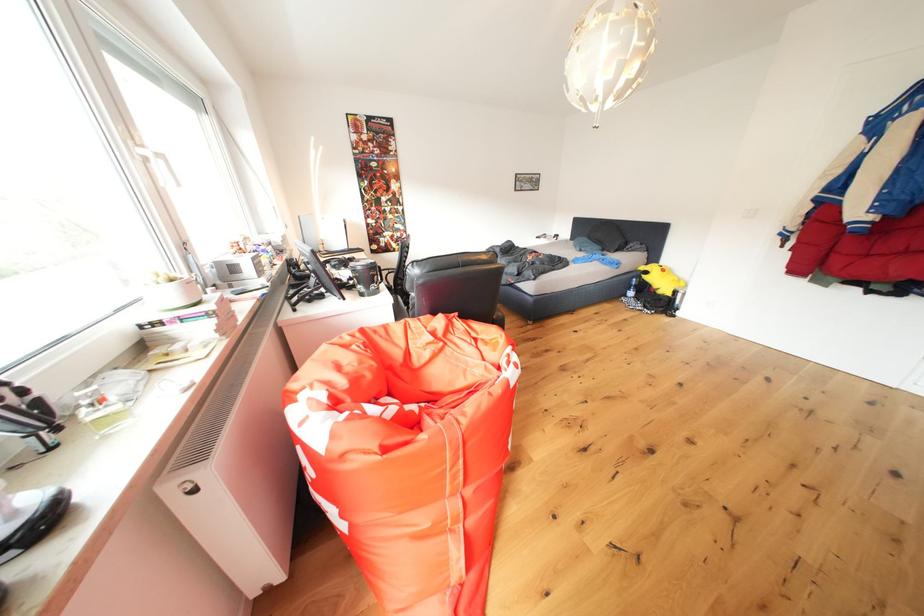
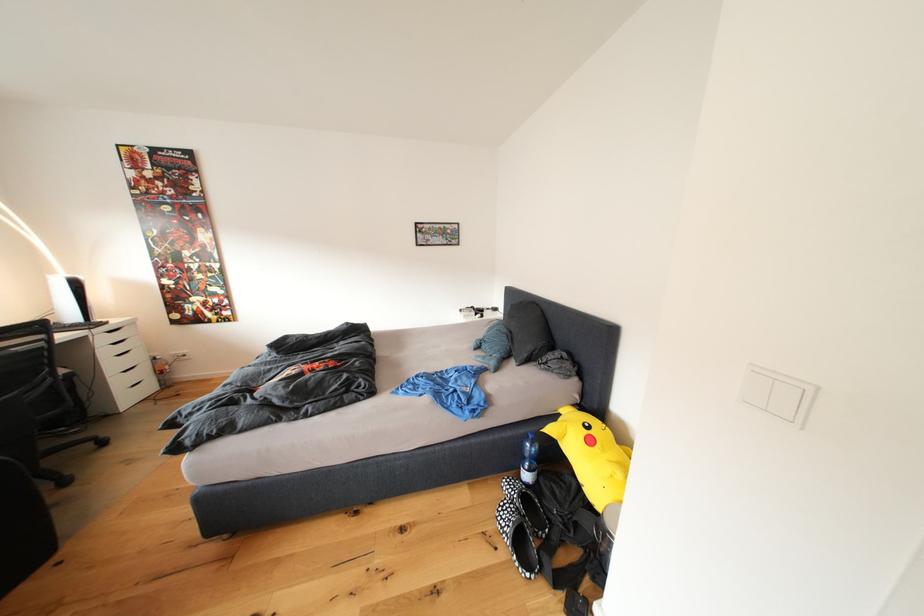
Locate, in the second image, the point that corresponds to the point at 640,286 in the first image.

(531, 451)